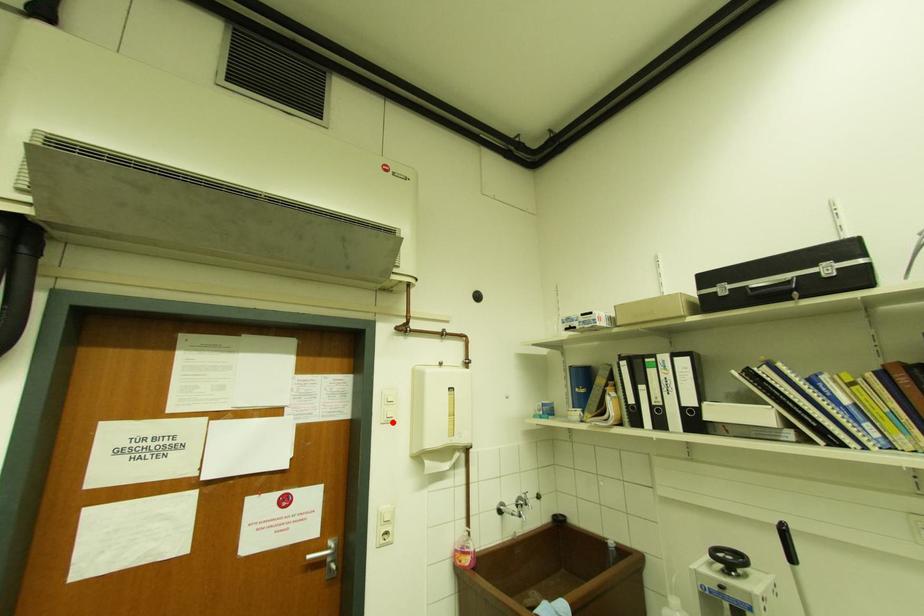
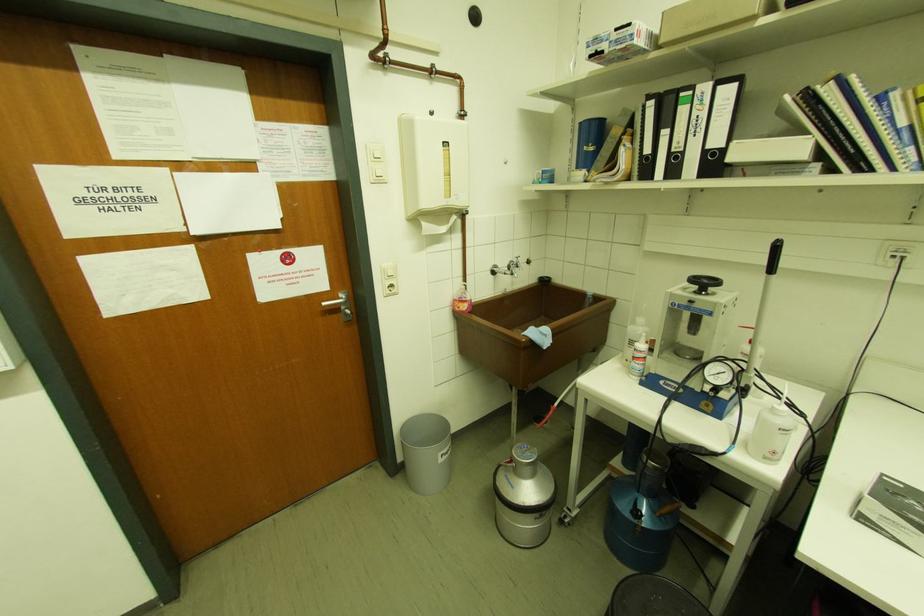
Locate, in the second image, the point that corresponds to the highlighted location in the first image.

(383, 182)